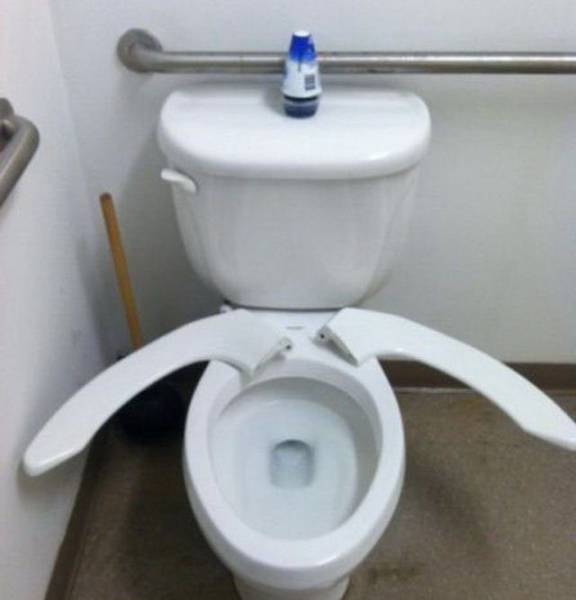
Find the location of `floor`. floor is located at coordinates (159, 526), (462, 486).